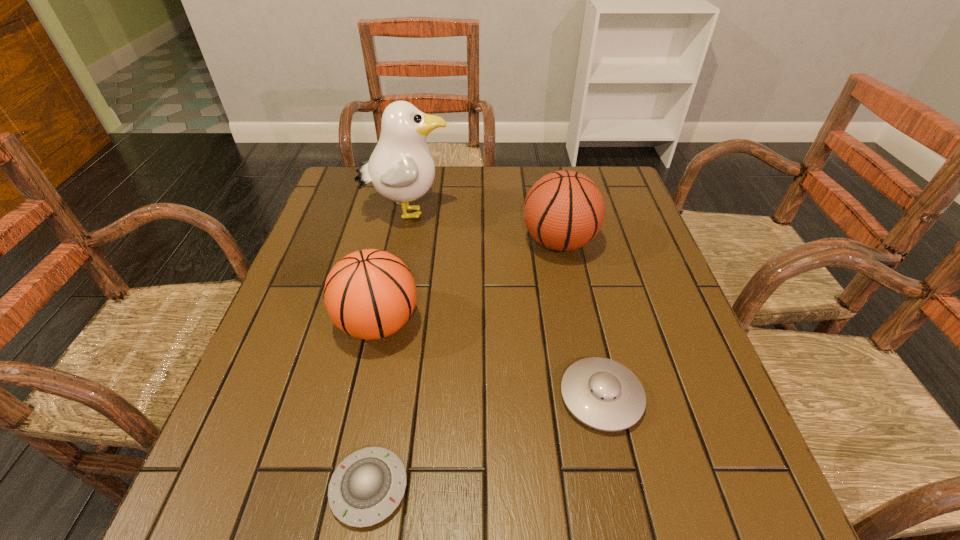
I want to click on saucer located at the right edge, so click(x=603, y=394).

The height and width of the screenshot is (540, 960). In order to click on object situated at the far left corner in this screenshot , I will do `click(401, 168)`.

Identify the location of vacant region at the far edge of the desktop. (524, 171).

Image resolution: width=960 pixels, height=540 pixels. In order to click on vacant area at the near edge of the desktop in this screenshot , I will do `click(526, 495)`.

This screenshot has height=540, width=960. Find the location of `vacant space at the left edge of the desktop`. vacant space at the left edge of the desktop is located at coordinates (314, 395).

Locate an element on the screen. Image resolution: width=960 pixels, height=540 pixels. vacant space at the right edge of the desktop is located at coordinates (615, 254).

Identify the location of free region at the far left corner of the desktop. (383, 200).

Where is `vacant position at the near left corner of the desktop`? This screenshot has height=540, width=960. vacant position at the near left corner of the desktop is located at coordinates (223, 511).

The width and height of the screenshot is (960, 540). Find the location of `blank region between the third farthest object and the right basketball`. blank region between the third farthest object and the right basketball is located at coordinates (468, 283).

Find the location of `unoccupied area between the tallest object and the farther basketball`. unoccupied area between the tallest object and the farther basketball is located at coordinates (483, 227).